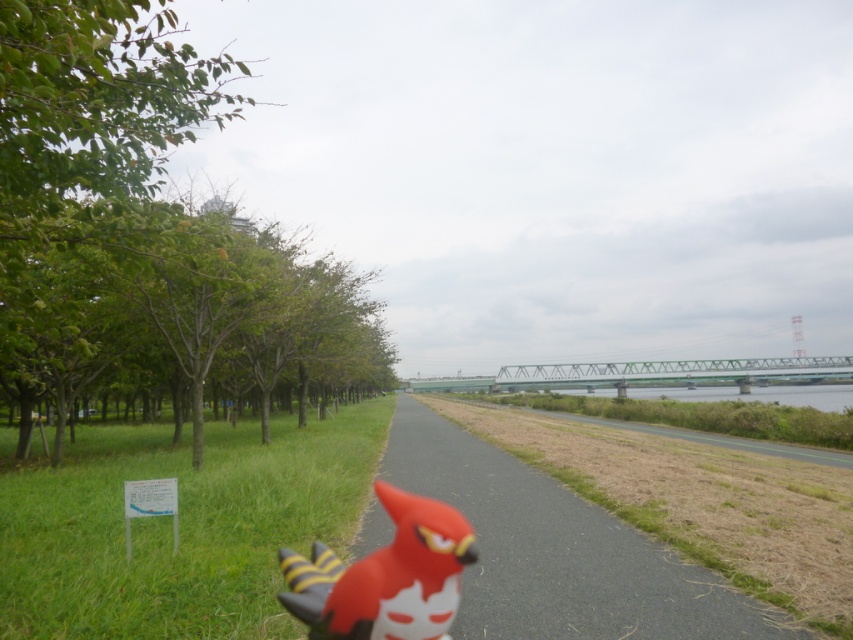
Question: Which of the following is the farthest from the observer?

Choices:
 (A) rubberized red bird at center
 (B) green leafy trees at left

Answer: (B)

Question: Based on their relative distances, which object is farther from the rubber duck at center?

Choices:
 (A) green grass at left
 (B) rubberized red bird at center
 (C) green leafy trees at left

Answer: (C)

Question: Does green leafy trees at left appear over rubber duck at center?

Choices:
 (A) yes
 (B) no

Answer: (A)

Question: Is green leafy trees at left to the right of rubber duck at center from the viewer's perspective?

Choices:
 (A) no
 (B) yes

Answer: (A)

Question: Can you confirm if rubber duck at center is positioned to the right of rubberized red bird at center?

Choices:
 (A) no
 (B) yes

Answer: (B)

Question: Based on their relative distances, which object is nearer to the green grass at left?

Choices:
 (A) rubberized red bird at center
 (B) rubber duck at center
 (C) green leafy trees at left

Answer: (C)